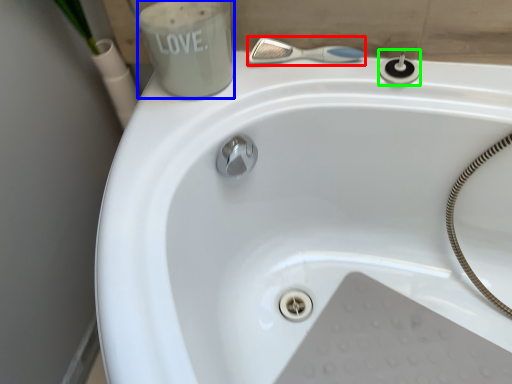
Question: Which object is positioned closest to shower (highlighted by a red box)? Select from liquid (highlighted by a blue box) and plumbing fixture (highlighted by a green box).

Choices:
 (A) liquid
 (B) plumbing fixture

Answer: (B)